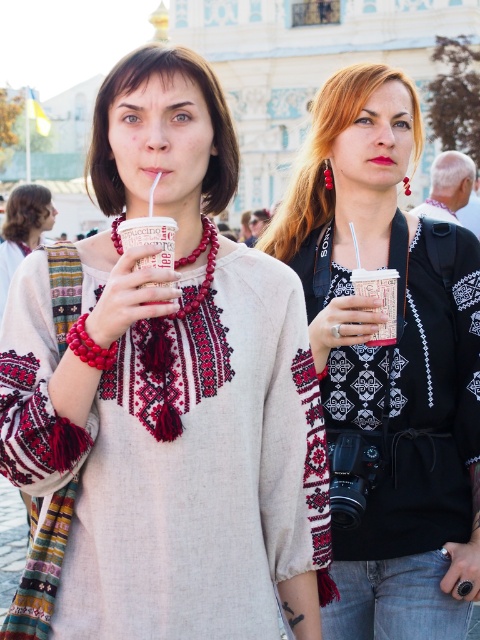
Is matte white cup at center below matte red scarf at left?

Yes.

Can you confirm if matte white cup at center is taller than matte red scarf at left?

Yes.

The image size is (480, 640). What do you see at coordinates (166, 397) in the screenshot?
I see `matte white cup at center` at bounding box center [166, 397].

Locate an element on the screen. The image size is (480, 640). matte white cup at center is located at coordinates 166,397.

Is matte white cup at center thinner than matte black scarf at center?

In fact, matte white cup at center might be wider than matte black scarf at center.

Which is in front, point (242, 522) or point (431, 536)?

Point (242, 522)

The image size is (480, 640). Find the location of `matte white cup at center`. matte white cup at center is located at coordinates (166, 397).

Is matte red scarf at left to the right of white paper cup at center from the viewer's perspective?

Incorrect, matte red scarf at left is not on the right side of white paper cup at center.

Is point (35, 208) positioned after point (158, 301)?

Yes.

Which is behind, point (2, 304) or point (153, 237)?

The point (2, 304) is behind.

The height and width of the screenshot is (640, 480). Find the location of `matte red scarf at left`. matte red scarf at left is located at coordinates (23, 228).